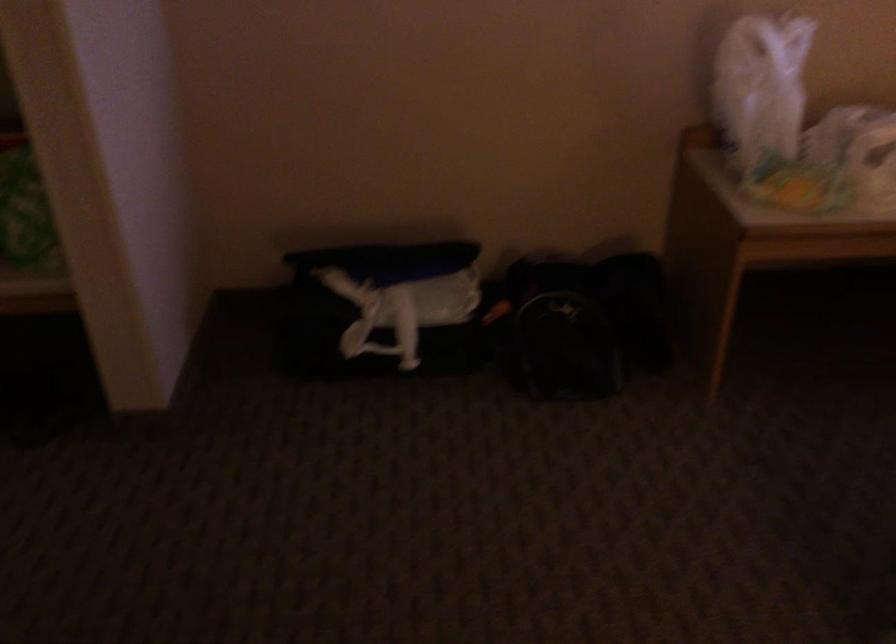
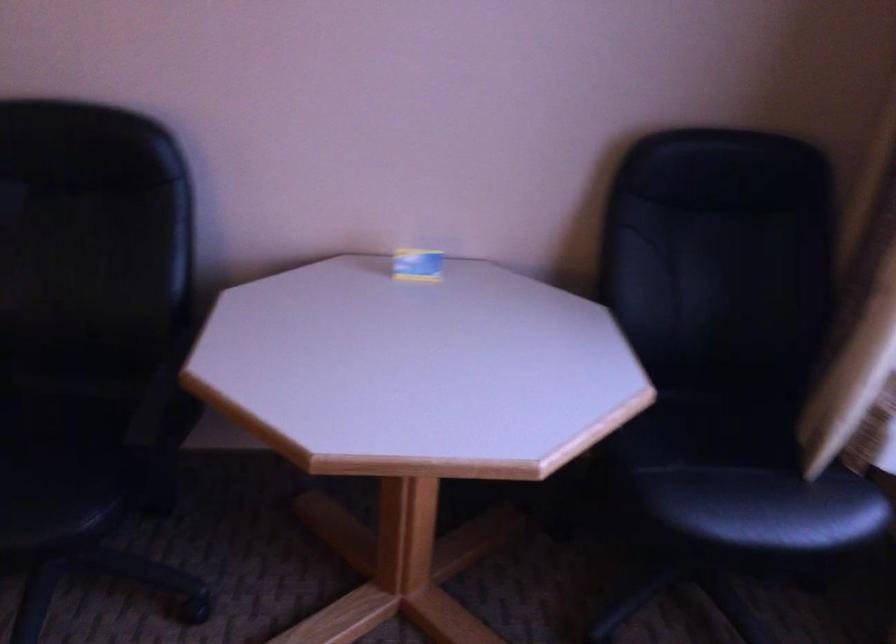
Question: What movement of the cameraman would produce the second image?

Choices:
 (A) Left
 (B) Right
 (C) Forward
 (D) Backward

Answer: (B)